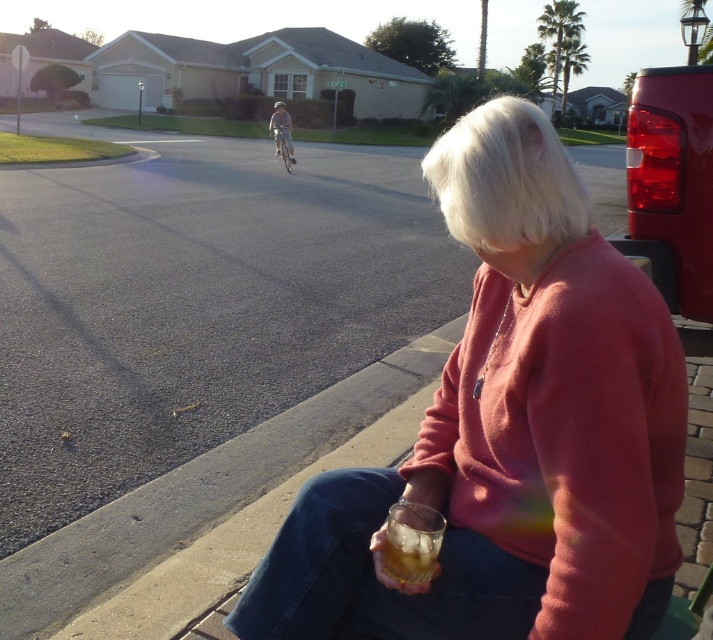
You are a delivery person trying to determine the best way to deliver packages to the houses on this suburban street. You notice a pink matte sweater at lower right and a translucent glass at lower center. Which object is larger in size?

The pink matte sweater at lower right is bigger than the translucent glass at lower center according to the description provided.

Based on the photo, you are a delivery person trying to deliver a package to the pink matte sweater at lower right. You have a box that is 1.2 meters tall. Can you hand the package to them without the box hitting the translucent glass at lower center?

The pink matte sweater at lower right is taller than the translucent glass at lower center. Since the box is 1.2 meters tall, it may hit the translucent glass at lower center if not handled carefully. However, since the person is taller than the glass, they can reach down to take the package without the box hitting the glass.

You are a delivery person trying to place a small package between the pink matte sweater at lower right and the translucent glass at lower center on the bench. Can you fit the package there?

The pink matte sweater at lower right might be wider than the translucent glass at lower center, so there may not be enough space to fit the package between them.